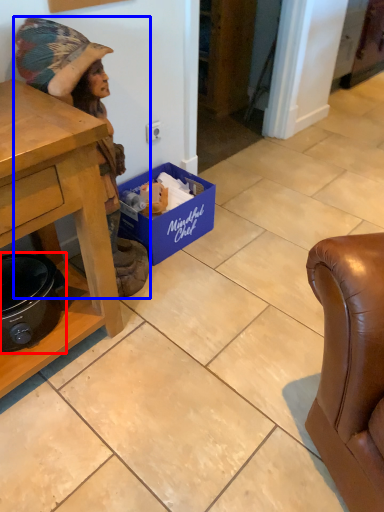
Question: Among these objects, which one is nearest to the camera, appliance (highlighted by a red box) or person (highlighted by a blue box)?

Choices:
 (A) appliance
 (B) person

Answer: (B)